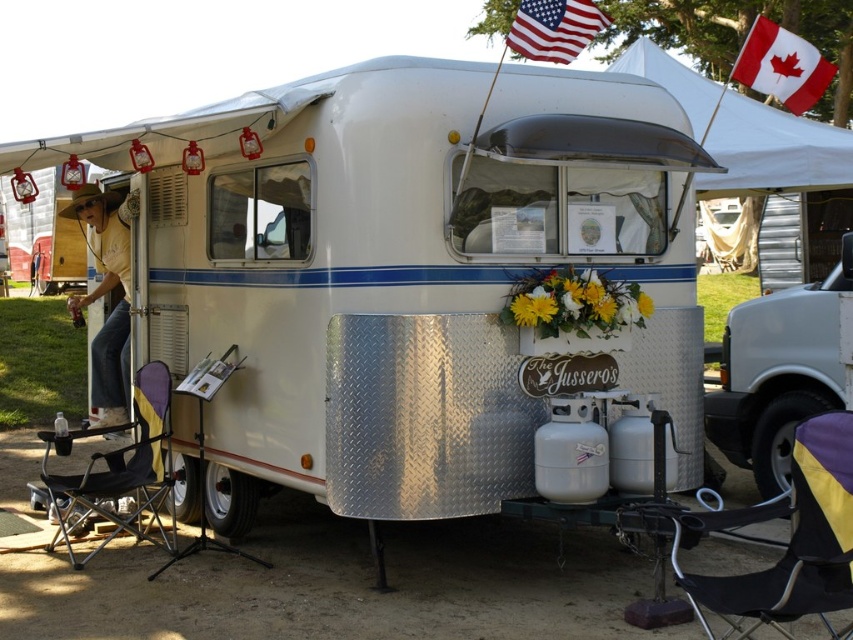
Question: Among these objects, which one is farthest from the camera?

Choices:
 (A) denim jeans at left
 (B) yellow and purple fabric chair at lower right

Answer: (A)

Question: Estimate the real-world distances between objects in this image. Which object is farther from the black fabric chair at lower left?

Choices:
 (A) yellow and purple fabric chair at lower right
 (B) american flag at upper center

Answer: (B)

Question: Which point appears closest to the camera in this image?

Choices:
 (A) (763, 572)
 (B) (111, 214)

Answer: (A)

Question: Observing the image, what is the correct spatial positioning of black fabric chair at lower left in reference to denim jeans at left?

Choices:
 (A) above
 (B) below

Answer: (B)

Question: Does black fabric chair at lower left appear on the right side of denim jeans at left?

Choices:
 (A) no
 (B) yes

Answer: (B)

Question: Can you confirm if white fabric canopy at upper center is positioned to the left of black fabric chair at lower left?

Choices:
 (A) no
 (B) yes

Answer: (A)